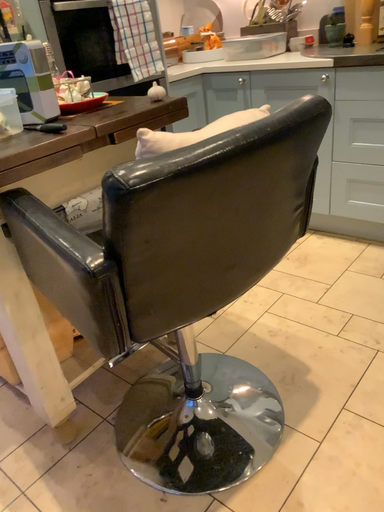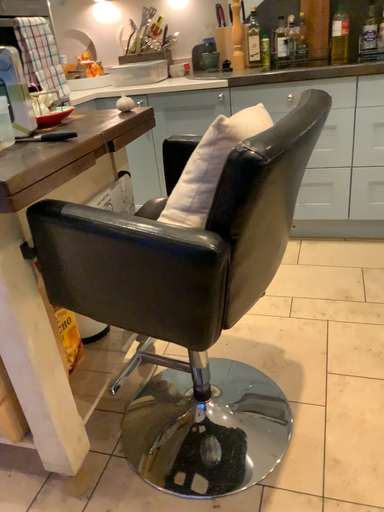
Question: How did the camera likely rotate when shooting the video?

Choices:
 (A) rotated downward
 (B) rotated upward

Answer: (B)